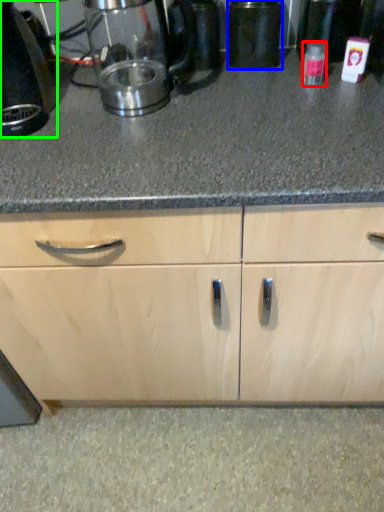
Question: Based on their relative distances, which object is farther from bottle (highlighted by a red box)? Choose from appliance (highlighted by a blue box) and home appliance (highlighted by a green box).

Choices:
 (A) appliance
 (B) home appliance

Answer: (B)